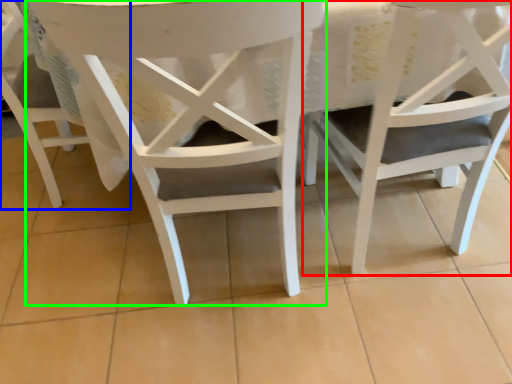
Question: Which object is the farthest from chair (highlighted by a red box)? Choose among these: chair (highlighted by a blue box) or chair (highlighted by a green box).

Choices:
 (A) chair
 (B) chair

Answer: (A)